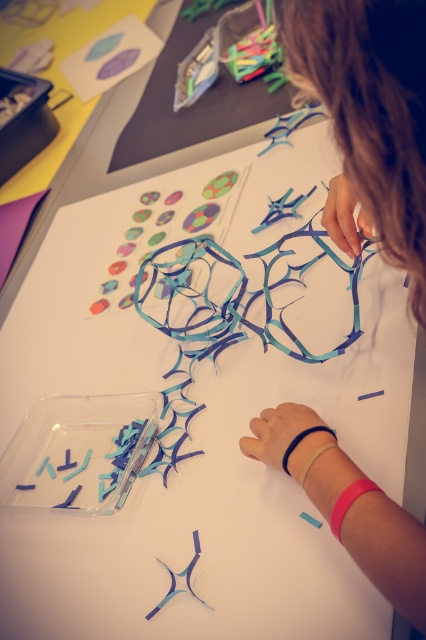
Between matte purple paper at upper left and translucent blue plastic at center, which one has more height?

matte purple paper at upper left

Which is behind, point (83, 60) or point (161, 600)?

The point (83, 60) is behind.

Is point (111, 77) in front of point (193, 540)?

No, (111, 77) is behind (193, 540).

I want to click on matte purple paper at upper left, so click(111, 56).

Can you confirm if teal matte plastic at center is taller than translucent blue plastic at center?

Indeed, teal matte plastic at center has a greater height compared to translucent blue plastic at center.

Is teal matte plastic at center positioned in front of translucent blue plastic at center?

Yes, it is in front of translucent blue plastic at center.

Between point (264, 420) and point (198, 552), which one is positioned behind?

The point (264, 420) is behind.

Where is `teal matte plastic at center`? teal matte plastic at center is located at coordinates (370, 120).

Does teal matte plastic at center appear on the left side of matte purple paper at upper left?

A: Incorrect, teal matte plastic at center is not on the left side of matte purple paper at upper left.

Who is taller, teal matte plastic at center or matte purple paper at upper left?

teal matte plastic at center

The width and height of the screenshot is (426, 640). What are the coordinates of `teal matte plastic at center` in the screenshot? It's located at (370, 120).

Locate an element on the screen. This screenshot has width=426, height=640. teal matte plastic at center is located at coordinates (370, 120).